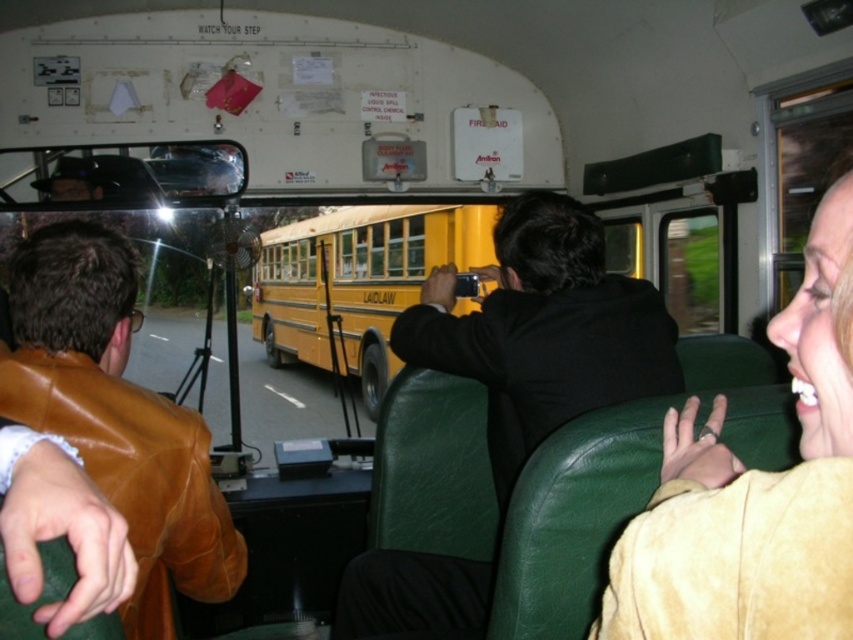
Question: Which point appears closest to the camera in this image?

Choices:
 (A) (126, 452)
 (B) (595, 333)
 (C) (815, 342)

Answer: (C)

Question: Does black matte jacket at center have a larger size compared to brown leather jacket at upper left?

Choices:
 (A) no
 (B) yes

Answer: (B)

Question: Among these points, which one is nearest to the camera?

Choices:
 (A) (811, 602)
 (B) (70, 394)

Answer: (A)

Question: Does light beige suede jacket at right appear on the left side of black matte jacket at center?

Choices:
 (A) yes
 (B) no

Answer: (B)

Question: Which point is closer to the camera?

Choices:
 (A) (x=160, y=547)
 (B) (x=695, y=497)

Answer: (B)

Question: Is light beige suede jacket at right above brown leather jacket at upper left?

Choices:
 (A) no
 (B) yes

Answer: (B)